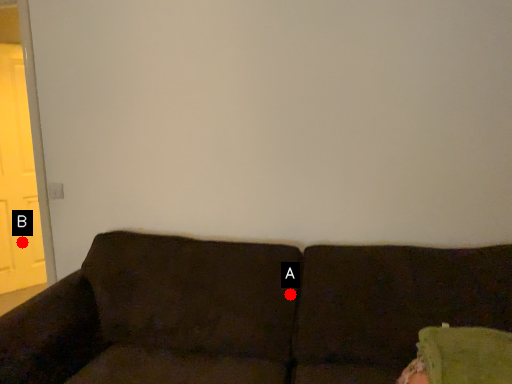
Question: Two points are circled on the image, labeled by A and B beside each circle. Which of the following is the farthest from the observer?

Choices:
 (A) A is further
 (B) B is further

Answer: (B)